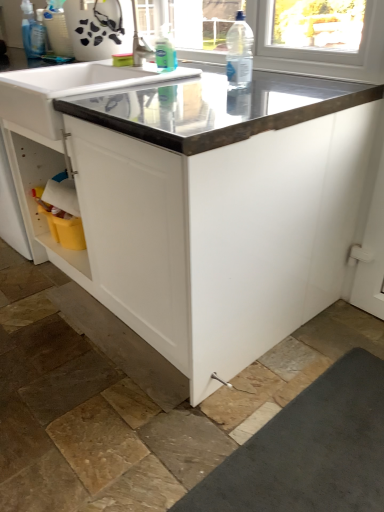
Identify the location of free space in front of clear plastic bottle at upper center. (230, 93).